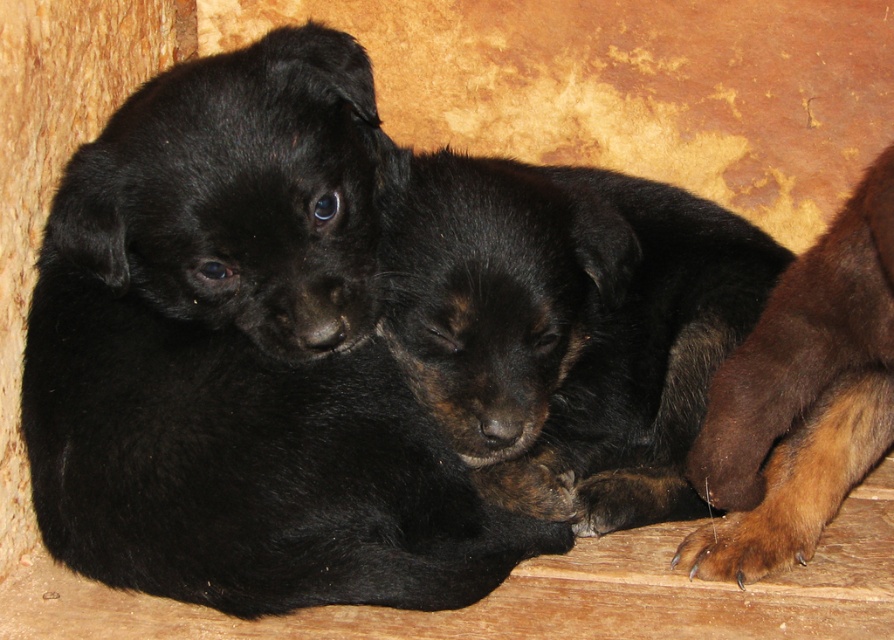
Measure the distance between black fur dog at center and camera.

black fur dog at center and camera are 1.47 meters apart from each other.

Does black fur dog at center appear under black fur puppy at upper left?

Correct, black fur dog at center is located below black fur puppy at upper left.

Does point (665, 346) come farther from viewer compared to point (344, 156)?

Yes, it is.

Find the location of a particular element. The width and height of the screenshot is (894, 640). black fur dog at center is located at coordinates (566, 326).

Which of these two, black fur puppies at center or black fur dog at center, stands taller?

Standing taller between the two is black fur puppies at center.

In the scene shown: Who is more distant from viewer, (209, 180) or (530, 428)?

The point (530, 428) is behind.

Locate an element on the screen. black fur puppies at center is located at coordinates (243, 355).

Can you confirm if black fur puppies at center is bigger than brown fuzzy paw at lower right?

Yes.

Can you confirm if black fur puppies at center is smaller than brown fuzzy paw at lower right?

No.

The width and height of the screenshot is (894, 640). What do you see at coordinates (243, 355) in the screenshot? I see `black fur puppies at center` at bounding box center [243, 355].

What are the coordinates of `black fur puppies at center` in the screenshot? It's located at (243, 355).